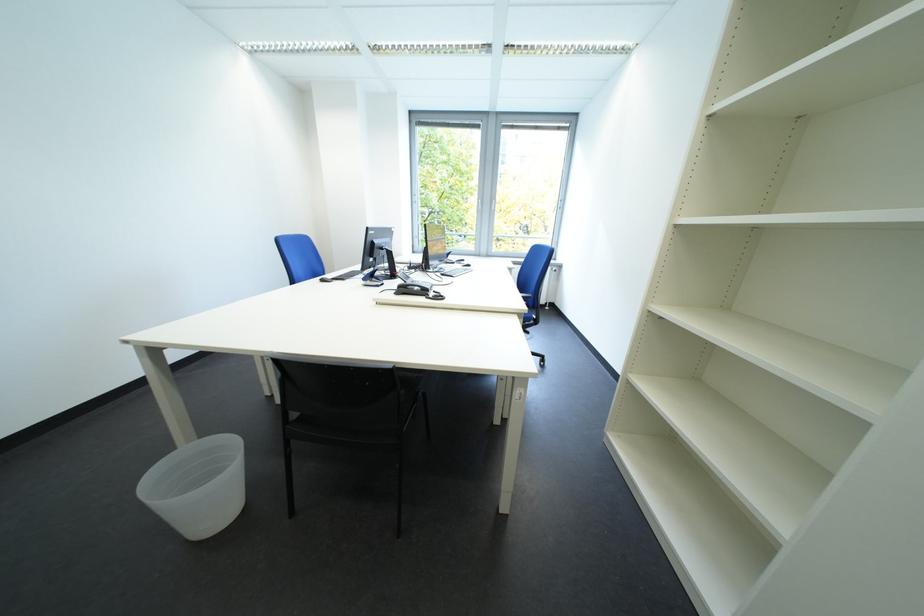
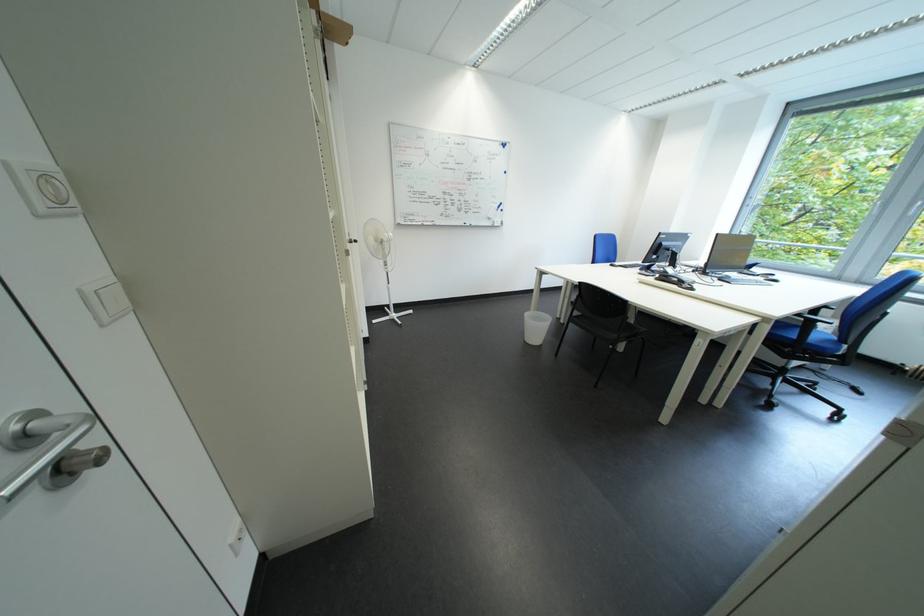
Locate, in the second image, the point that corresponds to (531,317) in the first image.

(777, 322)